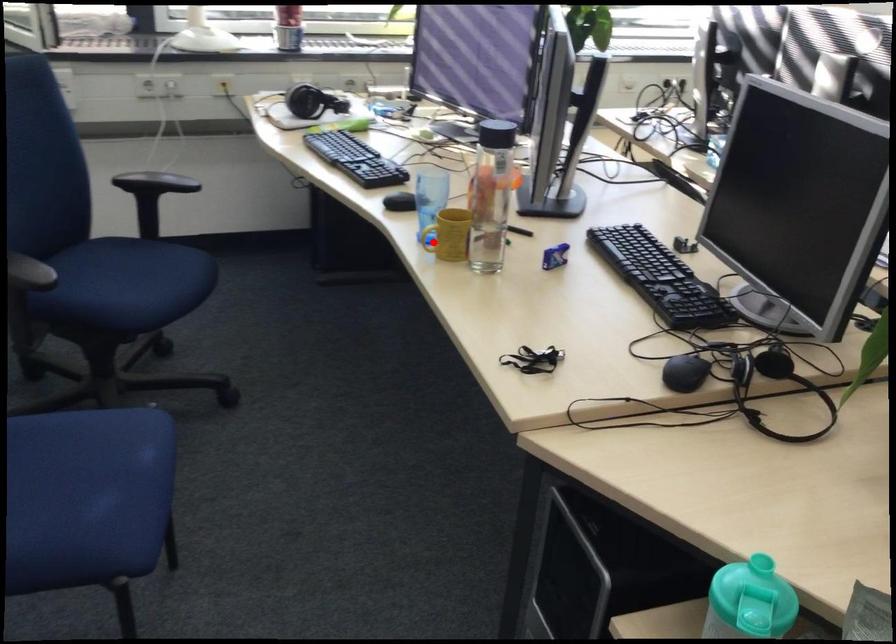
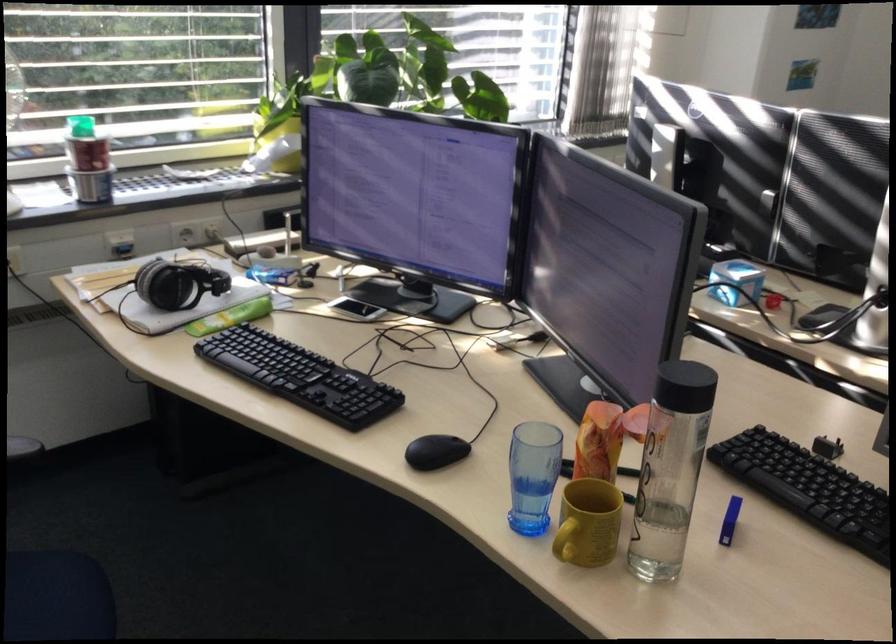
Where in the second image is the point corresponding to the highlighted location from the first image?

(564, 547)